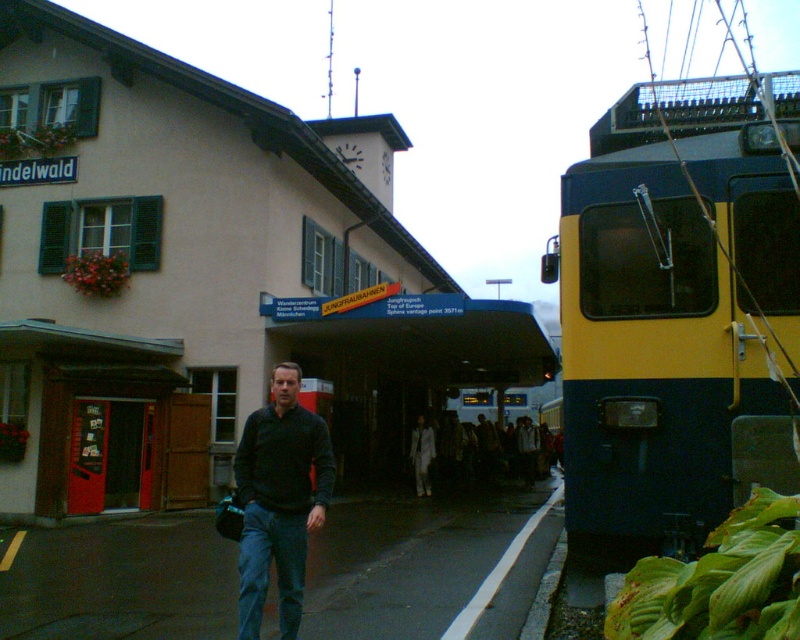
Does point (82, 195) come farther from viewer compared to point (640, 518)?

Yes, point (82, 195) is farther from viewer.

Which is in front, point (112, 472) or point (656, 140)?

Point (656, 140) is more forward.

Find the location of `yellow metal train at right`. yellow metal train at right is located at coordinates (206, 278).

Does point (605, 500) come farther from viewer compared to point (254, 484)?

No, (605, 500) is closer to viewer.

Which is in front, point (678, 113) or point (244, 625)?

Point (244, 625) is in front.

Does point (682, 496) come in front of point (240, 573)?

No, (682, 496) is further to viewer.

Identify the location of yellow and blue train at right. (670, 305).

From the picture: Who is lower down, yellow metal train at right or black matte sweater at center?

black matte sweater at center

What do you see at coordinates (206, 278) in the screenshot? The height and width of the screenshot is (640, 800). I see `yellow metal train at right` at bounding box center [206, 278].

I want to click on yellow metal train at right, so (206, 278).